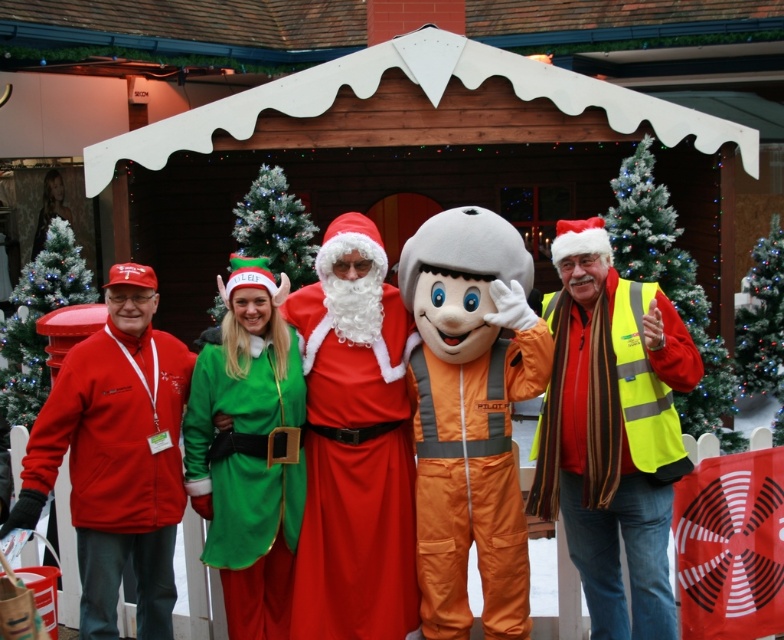
Does matte red jacket at left have a smaller size compared to green matte christmas tree at center?

Yes.

Is matte red jacket at left thinner than green matte christmas tree at center?

Yes, matte red jacket at left is thinner than green matte christmas tree at center.

Is point (64, 266) closer to viewer compared to point (746, 280)?

Yes, it is in front of point (746, 280).

Identify the location of matte red jacket at left. (37, 317).

Between point (241, 506) and point (757, 312), which one is positioned in front?

Point (241, 506)

Which is more to the right, green felt coat at center or green matte christmas tree at center?

Positioned to the right is green matte christmas tree at center.

At what (x,y) coordinates should I click in order to perform the action: click on green felt coat at center. Please return your answer as a coordinate pair (x, y). This screenshot has width=784, height=640. Looking at the image, I should click on (249, 472).

Where is `green felt coat at center`? green felt coat at center is located at coordinates (249, 472).

Can you confirm if matte fleece jacket at left is thinner than matte red jacket at left?

Indeed, matte fleece jacket at left has a lesser width compared to matte red jacket at left.

Is point (66, 385) less distant than point (6, 342)?

Yes, it is.

Find the location of `matte fleece jacket at left`. matte fleece jacket at left is located at coordinates (115, 468).

Locate an element on the screen. The image size is (784, 640). matte fleece jacket at left is located at coordinates pyautogui.click(x=115, y=468).